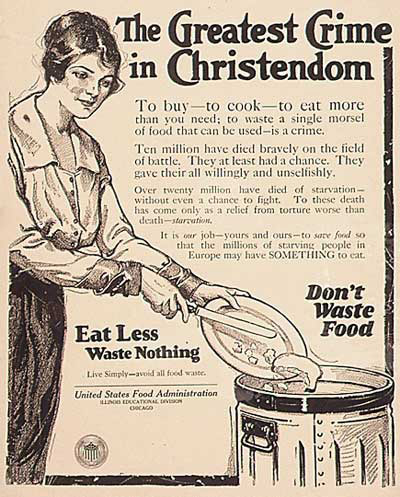
Identify the location of plate. (222, 345).